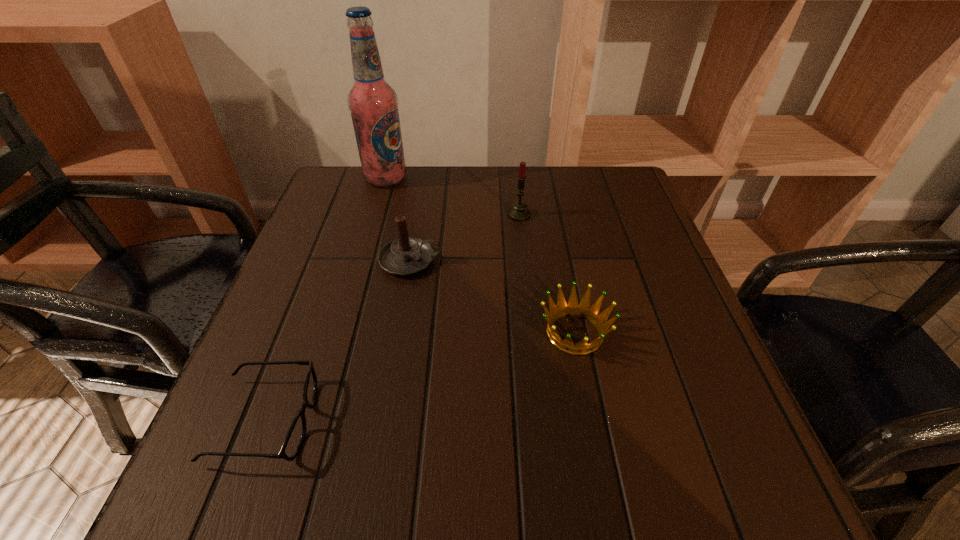
You are a GUI agent. You are given a task and a screenshot of the screen. Output one action in this format:
    pyautogui.click(x=<x>, y=<y>)
    Task: Click on the vacant region between the right candle and the third farthest object
    
    Given the screenshot: What is the action you would take?
    pyautogui.click(x=465, y=238)

This screenshot has width=960, height=540. I want to click on vacant space in between the nearest object and the third farthest object, so click(x=338, y=341).

Find the location of a particular element. Image resolution: width=960 pixels, height=540 pixels. empty space between the shortest object and the third farthest object is located at coordinates (338, 341).

Locate an element on the screen. free spot between the crown and the shorter candle is located at coordinates (492, 296).

Locate an element on the screen. vacant point located between the right candle and the nearer candle is located at coordinates (465, 238).

Locate an element on the screen. free space between the fourth shortest object and the crown is located at coordinates (547, 274).

Locate an element on the screen. This screenshot has height=540, width=960. free space between the third farthest object and the shortest object is located at coordinates (338, 341).

You are a GUI agent. You are given a task and a screenshot of the screen. Output one action in this format:
    pyautogui.click(x=<x>, y=<y>)
    Task: Click on the object that can be found as the fourth closest to the shorter candle
    
    Given the screenshot: What is the action you would take?
    pyautogui.click(x=294, y=439)

Locate which object ranks third in proximity to the crown. Please provide its 2D coordinates. Your answer should be formatted as a tuple, i.e. [(x, y)], where the tuple contains the x and y coordinates of a point satisfying the conditions above.

[(294, 439)]

You are a GUI agent. You are given a task and a screenshot of the screen. Output one action in this format:
    pyautogui.click(x=<x>, y=<y>)
    Task: Click on the free location that satisfies the following two spatial constraints: 1. on the front side of the second shortest object; 2. on the front-facing side of the nearest object
    This screenshot has width=960, height=540.
    Given the screenshot: What is the action you would take?
    pyautogui.click(x=592, y=421)